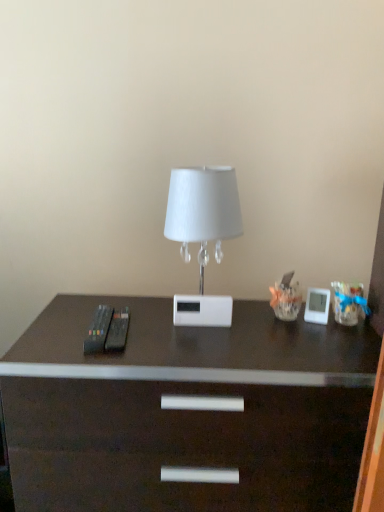
Question: Could you tell me if dark wood desk at center is facing white glossy lamp at center?

Choices:
 (A) no
 (B) yes

Answer: (A)

Question: From the image's perspective, is dark wood desk at center on white glossy lamp at center?

Choices:
 (A) no
 (B) yes

Answer: (A)

Question: Considering the relative sizes of dark wood desk at center and white glossy lamp at center in the image provided, is dark wood desk at center bigger than white glossy lamp at center?

Choices:
 (A) yes
 (B) no

Answer: (A)

Question: From a real-world perspective, is dark wood desk at center below white glossy lamp at center?

Choices:
 (A) no
 (B) yes

Answer: (B)

Question: Is dark wood desk at center behind white glossy lamp at center?

Choices:
 (A) yes
 (B) no

Answer: (B)

Question: Is dark wood desk at center not within white glossy lamp at center?

Choices:
 (A) no
 (B) yes

Answer: (B)

Question: Is white glossy lamp at center at the right side of dark wood desk at center?

Choices:
 (A) yes
 (B) no

Answer: (A)

Question: Does white glossy lamp at center contain dark wood desk at center?

Choices:
 (A) no
 (B) yes

Answer: (A)

Question: Is white glossy lamp at center positioned behind dark wood desk at center?

Choices:
 (A) no
 (B) yes

Answer: (B)

Question: From the image's perspective, is white glossy lamp at center over dark wood desk at center?

Choices:
 (A) no
 (B) yes

Answer: (B)

Question: Does white glossy lamp at center have a lesser width compared to dark wood desk at center?

Choices:
 (A) no
 (B) yes

Answer: (B)

Question: Is white glossy lamp at center outside dark wood desk at center?

Choices:
 (A) no
 (B) yes

Answer: (B)

Question: Is dark wood desk at center bigger or smaller than white glossy lamp at center?

Choices:
 (A) big
 (B) small

Answer: (A)